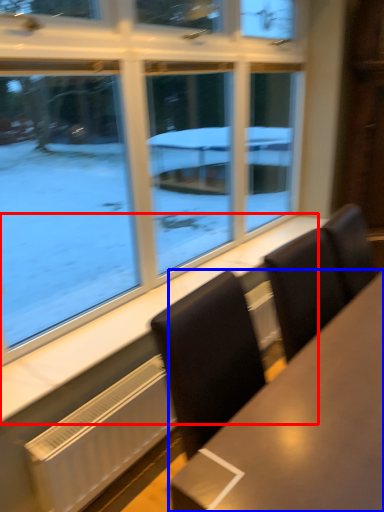
Question: Which object is closer to the camera taking this photo, window sill (highlighted by a red box) or table (highlighted by a blue box)?

Choices:
 (A) window sill
 (B) table

Answer: (B)